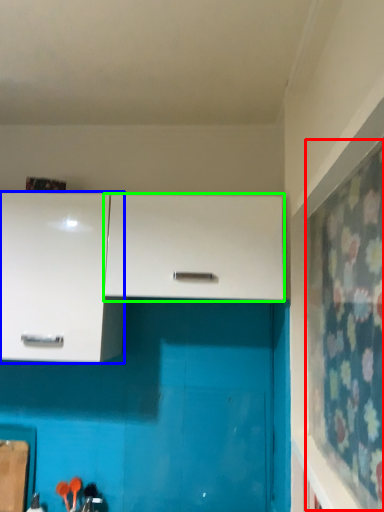
Question: Which object is the farthest from curtain (highlighted by a red box)? Choose among these: cabinetry (highlighted by a blue box) or cabinetry (highlighted by a green box).

Choices:
 (A) cabinetry
 (B) cabinetry

Answer: (A)